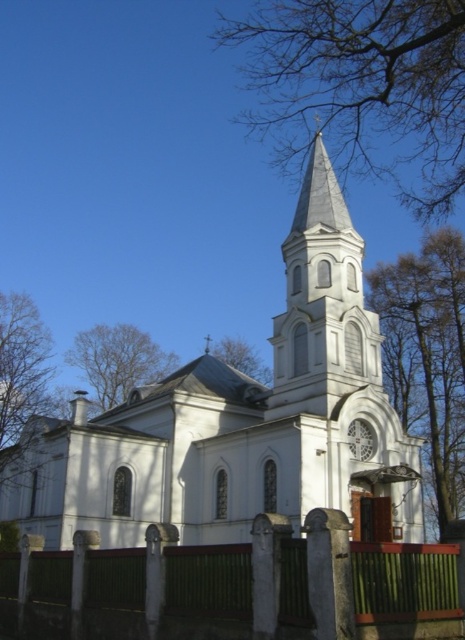
Between point (26, 412) and point (237, 337), which one is positioned behind?

Point (237, 337)

Does brown wood tree at left have a smaller size compared to green leafy tree at upper center?

Incorrect, brown wood tree at left is not smaller in size than green leafy tree at upper center.

Is point (14, 380) closer to viewer compared to point (236, 365)?

That is True.

Locate an element on the screen. Image resolution: width=465 pixels, height=640 pixels. brown wood tree at left is located at coordinates (22, 384).

Does bare branches at upper right appear on the left side of brown wood tree at left?

In fact, bare branches at upper right is to the right of brown wood tree at left.

Does bare branches at upper right lie in front of brown wood tree at left?

Yes, bare branches at upper right is in front of brown wood tree at left.

Locate an element on the screen. The height and width of the screenshot is (640, 465). bare branches at upper right is located at coordinates (363, 88).

Between green leafy tree at right and brown wood tree at left, which one appears on the left side from the viewer's perspective?

Positioned to the left is brown wood tree at left.

Between point (414, 365) and point (22, 307), which one is positioned behind?

The point (22, 307) is behind.

Identify the location of green leafy tree at right. This screenshot has height=640, width=465. (427, 355).